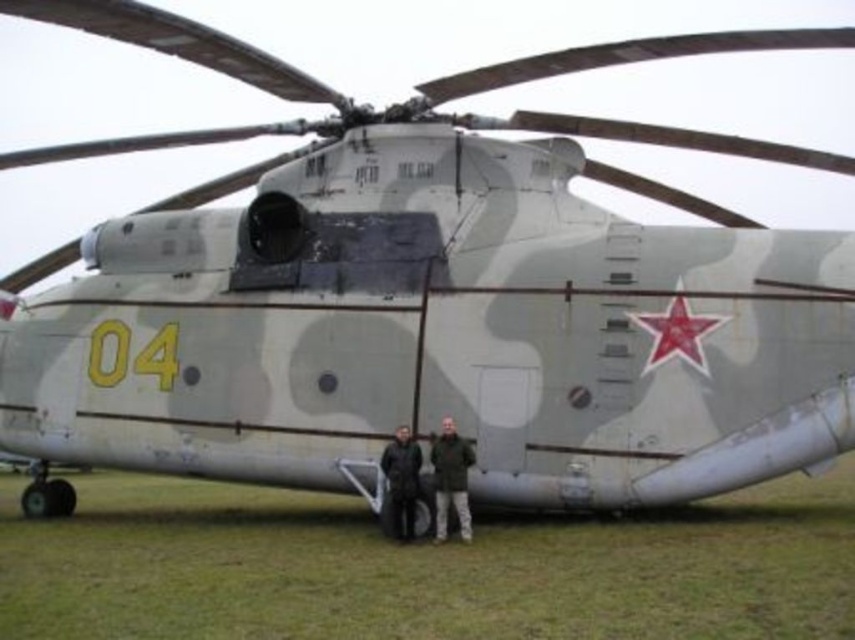
Find the location of a particular element. green grass at lower center is located at coordinates (422, 566).

Is green grass at lower center bigger than black matte jacket at center?

Yes, green grass at lower center is bigger than black matte jacket at center.

Between point (228, 595) and point (394, 508), which one is positioned behind?

The point (394, 508) is more distant.

Identify the location of green grass at lower center. This screenshot has width=855, height=640. (422, 566).

In order to click on green grass at lower center in this screenshot , I will do `click(422, 566)`.

The width and height of the screenshot is (855, 640). In order to click on green grass at lower center in this screenshot , I will do `click(422, 566)`.

Where is `dark green fabric jacket at center`? dark green fabric jacket at center is located at coordinates (451, 480).

Between dark green fabric jacket at center and black matte jacket at center, which one is positioned higher?

dark green fabric jacket at center is higher up.

Describe the element at coordinates (451, 480) in the screenshot. I see `dark green fabric jacket at center` at that location.

Locate an element on the screen. dark green fabric jacket at center is located at coordinates (451, 480).